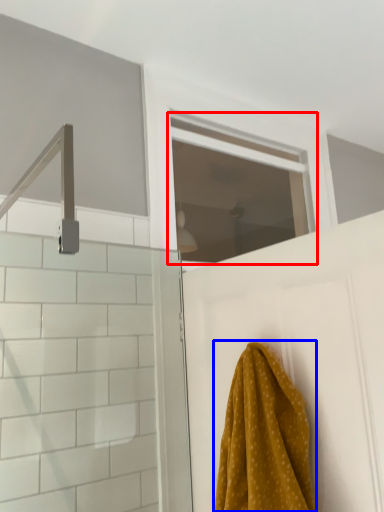
Question: Which point is further to the camera, window (highlighted by a red box) or towel (highlighted by a blue box)?

Choices:
 (A) window
 (B) towel

Answer: (A)